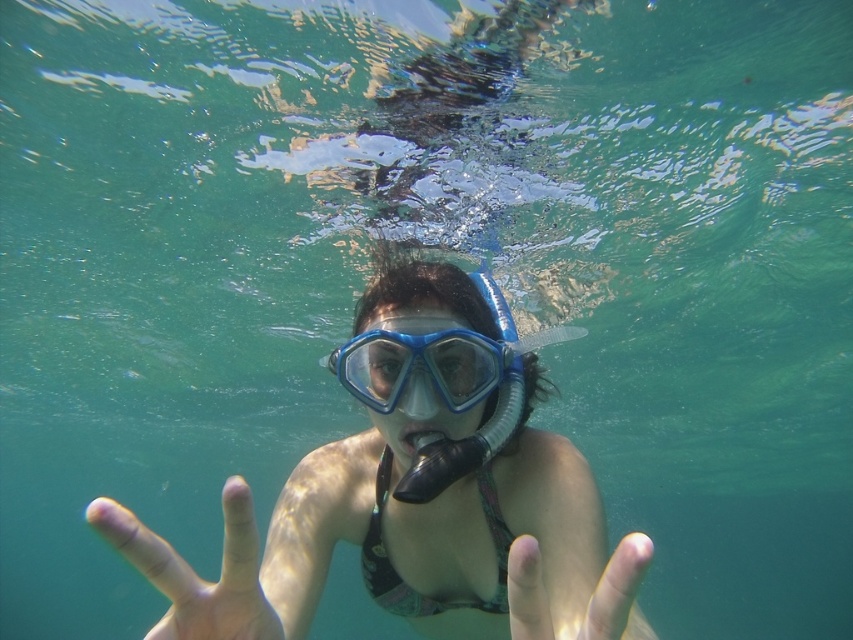
Question: Can you confirm if transparent blue snorkel mask at center is thinner than pale skin at center?

Choices:
 (A) yes
 (B) no

Answer: (A)

Question: Can you confirm if transparent blue snorkel mask at center is positioned to the left of smooth skin hand at center?

Choices:
 (A) no
 (B) yes

Answer: (B)

Question: Which object is farther from the camera taking this photo?

Choices:
 (A) smooth skin hand at center
 (B) blue matte snorkel mask at center
 (C) transparent blue snorkel mask at center

Answer: (B)

Question: Observing the image, what is the correct spatial positioning of pale skin at center in reference to blue matte snorkel mask at center?

Choices:
 (A) above
 (B) below

Answer: (B)

Question: Which of the following is the closest to the observer?

Choices:
 (A) smooth skin hand at center
 (B) pale skin at center

Answer: (A)

Question: Estimate the real-world distances between objects in this image. Which object is farther from the transparent blue snorkel mask at center?

Choices:
 (A) smooth skin hand at center
 (B) blue matte snorkel mask at center

Answer: (A)